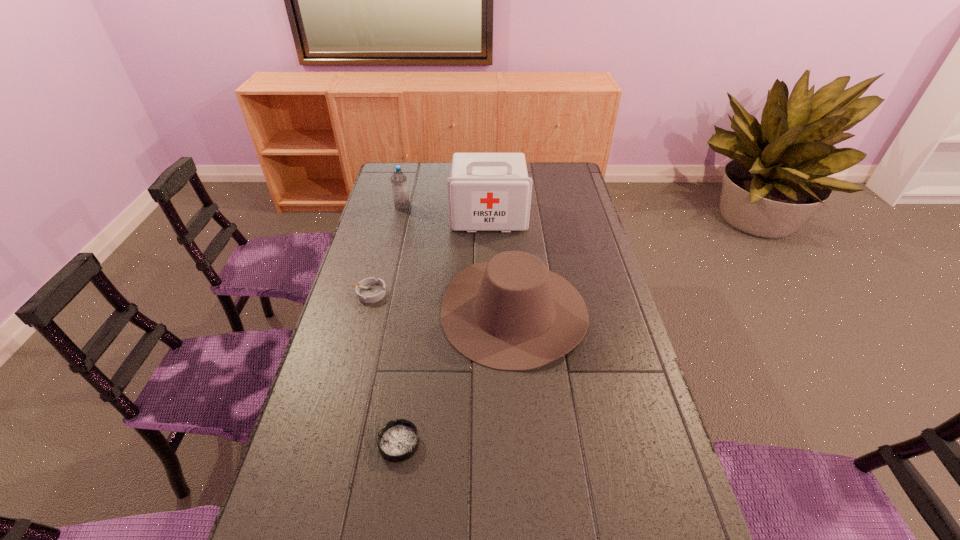
This screenshot has height=540, width=960. In order to click on vacant point located between the nearer ashtray and the left ashtray in this screenshot , I will do `click(384, 368)`.

You are a GUI agent. You are given a task and a screenshot of the screen. Output one action in this format:
    pyautogui.click(x=<x>, y=<y>)
    Task: Click on the vacant space in between the third object from right to left and the cowboy hat
    
    Given the screenshot: What is the action you would take?
    pyautogui.click(x=457, y=377)

The width and height of the screenshot is (960, 540). I want to click on empty space that is in between the left ashtray and the water bottle, so click(386, 250).

You are a GUI agent. You are given a task and a screenshot of the screen. Output one action in this format:
    pyautogui.click(x=<x>, y=<y>)
    Task: Click on the vacant space that's between the cowboy hat and the water bottle
    The width and height of the screenshot is (960, 540).
    Given the screenshot: What is the action you would take?
    pyautogui.click(x=458, y=259)

Where is `empty location between the nearest object and the cowboy hat`? The width and height of the screenshot is (960, 540). empty location between the nearest object and the cowboy hat is located at coordinates (457, 377).

The width and height of the screenshot is (960, 540). What are the coordinates of `empty location between the water bottle and the cowboy hat` in the screenshot? It's located at (458, 259).

Select which object is the third closest to the water bottle. Please provide its 2D coordinates. Your answer should be formatted as a tuple, i.e. [(x, y)], where the tuple contains the x and y coordinates of a point satisfying the conditions above.

[(369, 290)]

This screenshot has width=960, height=540. Identify the location of the fourth closest object to the water bottle. (397, 441).

I want to click on free location that satisfies the following two spatial constraints: 1. on the front-facing side of the cowboy hat; 2. on the left side of the tallest object, so 491,311.

This screenshot has height=540, width=960. In order to click on free spot that satisfies the following two spatial constraints: 1. on the front-facing side of the tallest object; 2. on the right side of the cowboy hat in this screenshot , I will do `click(491, 311)`.